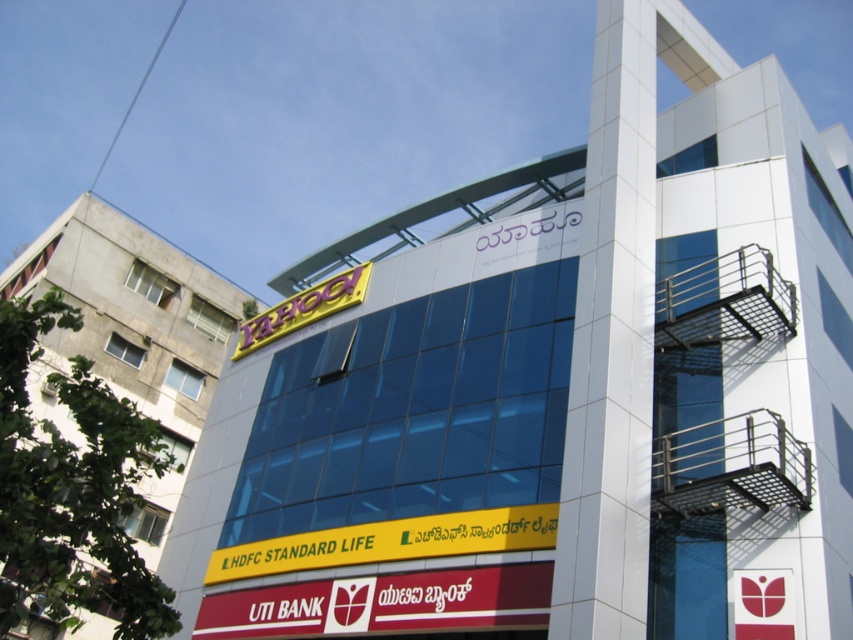
Question: Which point is farther from the camera taking this photo?

Choices:
 (A) (260, 326)
 (B) (204, 324)

Answer: (B)

Question: Is yellow glossy sign at upper left to the left of yellow plastic yahoo! sign at upper center from the viewer's perspective?

Choices:
 (A) yes
 (B) no

Answer: (A)

Question: Can you confirm if yellow glossy sign at upper left is positioned above yellow plastic yahoo! sign at upper center?

Choices:
 (A) yes
 (B) no

Answer: (A)

Question: Does yellow glossy sign at upper left have a greater width compared to yellow plastic yahoo! sign at upper center?

Choices:
 (A) no
 (B) yes

Answer: (B)